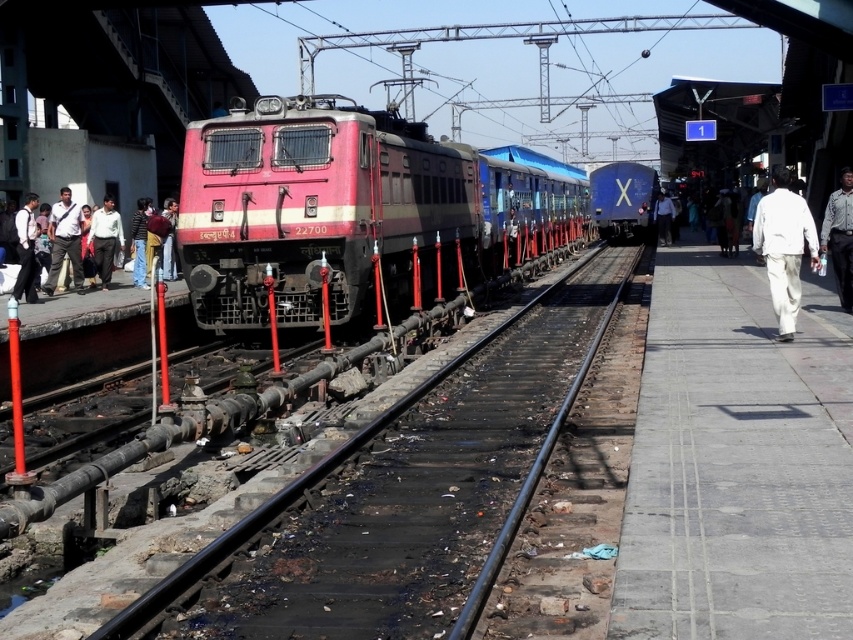
Question: Does black metal train track at center appear under matte black shirt at left?

Choices:
 (A) yes
 (B) no

Answer: (A)

Question: Which point is closer to the camera?

Choices:
 (A) (96, 237)
 (B) (64, 218)
 (C) (659, 243)
 (D) (27, 193)

Answer: (B)

Question: Which point appears closest to the camera in this image?

Choices:
 (A) (109, 237)
 (B) (78, 260)

Answer: (B)

Question: Does light brown shirt at left appear on the right side of denim pants at left?

Choices:
 (A) yes
 (B) no

Answer: (B)

Question: Is dark blue shirt at left thinner than white cotton shirt at center-right?

Choices:
 (A) no
 (B) yes

Answer: (B)

Question: Considering the real-world distances, which object is closest to the blue glossy train at center?

Choices:
 (A) white cotton pants at right
 (B) black metal train track at center
 (C) dark blue shirt at left
 (D) matte black shirt at left

Answer: (A)